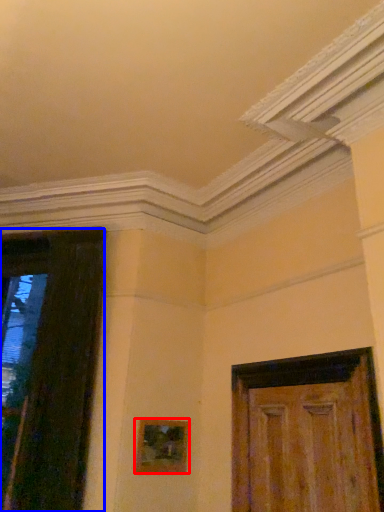
Question: Among these objects, which one is nearest to the camera, picture frame (highlighted by a red box) or door (highlighted by a blue box)?

Choices:
 (A) picture frame
 (B) door

Answer: (B)